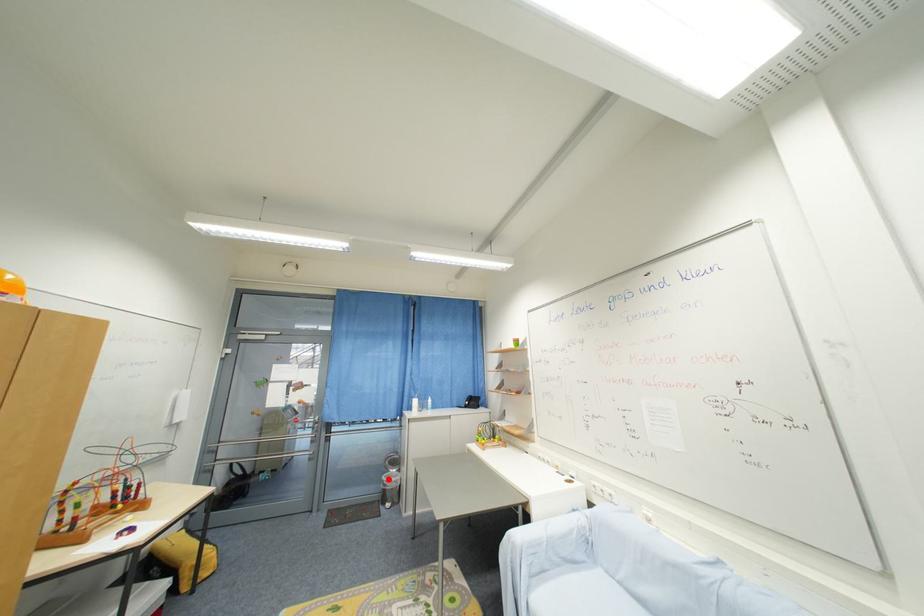
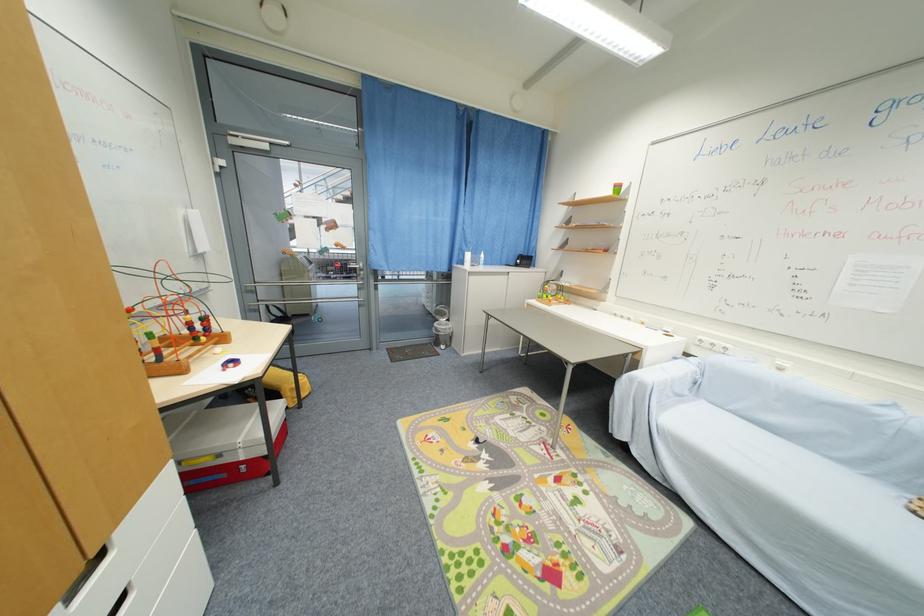
The point at the highlighted location is marked in the first image. Where is the corresponding point in the second image?

(441, 326)